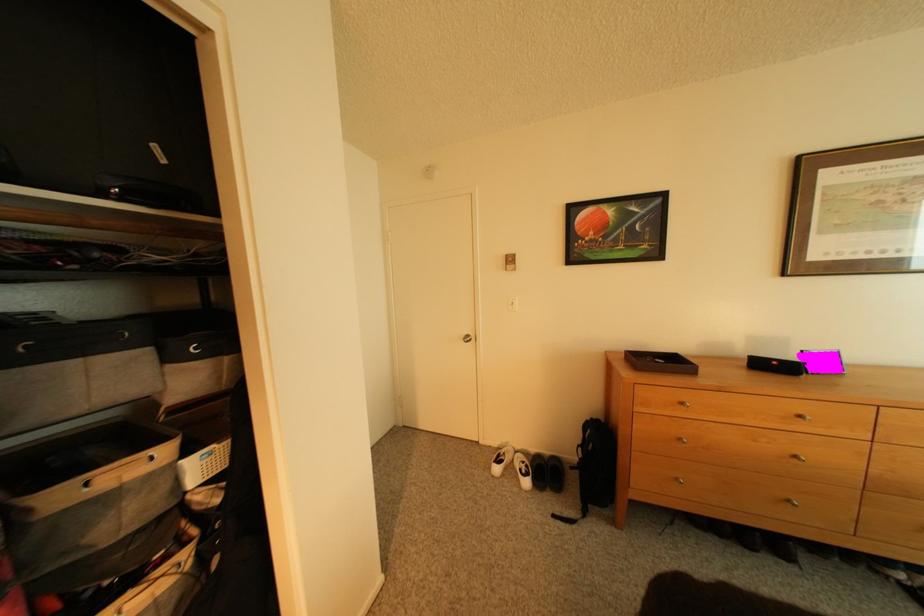
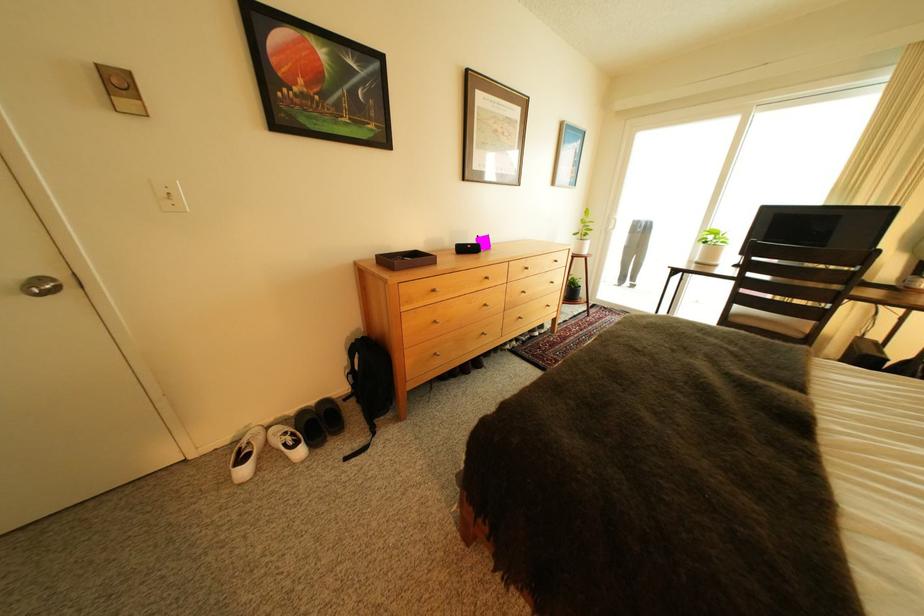
Locate, in the second image, the point that corresponds to the point at 759,360 in the first image.

(467, 248)